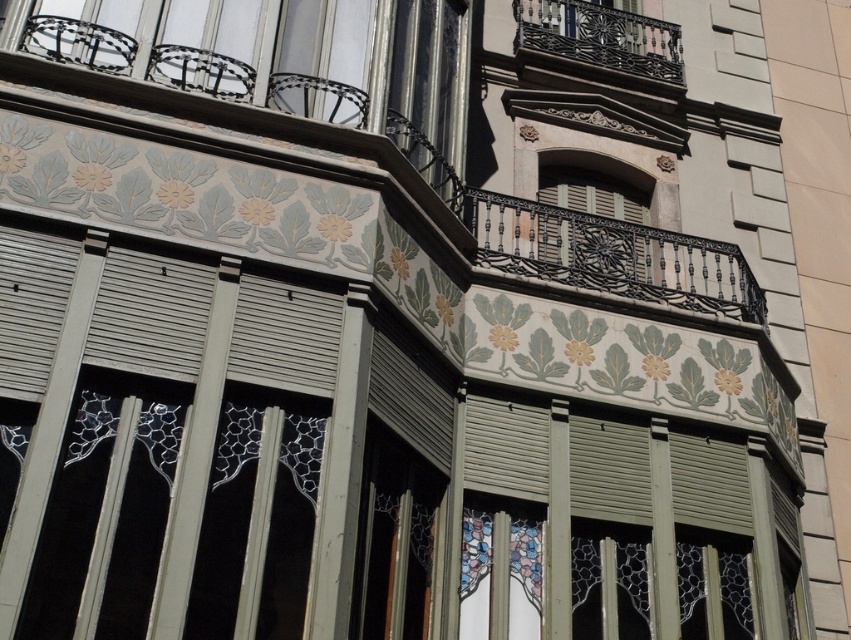
You are an architect examining the building facade. You notice two balconies, the black wrought iron balcony at center and the dark brown wrought iron balcony at upper center. Which one is positioned to the left of the other?

The black wrought iron balcony at center is positioned to the left of the dark brown wrought iron balcony at upper center.

You are standing in front of the building and want to touch the black wrought iron balcony at center and the dark brown wrought iron balcony at upper center. Which one can you reach without climbing any stairs?

The black wrought iron balcony at center is closer to the viewer than the dark brown wrought iron balcony at upper center, so you can reach the black wrought iron balcony at center without climbing stairs.

You are an architect examining the building facade. You notice the black wrought iron balcony at center and the dark brown wrought iron balcony at upper center. Which balcony is located below the other?

The black wrought iron balcony at center is positioned under the dark brown wrought iron balcony at upper center, so the black wrought iron balcony at center is below the dark brown wrought iron balcony at upper center.